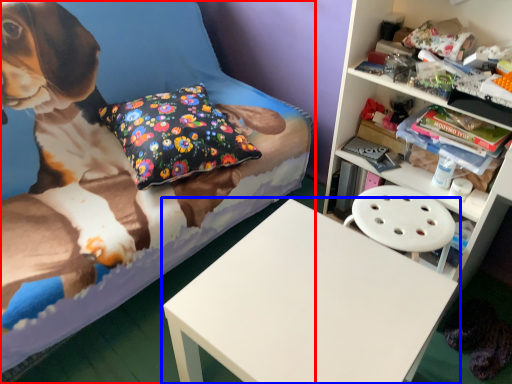
Question: Among these objects, which one is nearest to the camera, bed (highlighted by a red box) or table (highlighted by a blue box)?

Choices:
 (A) bed
 (B) table

Answer: (A)